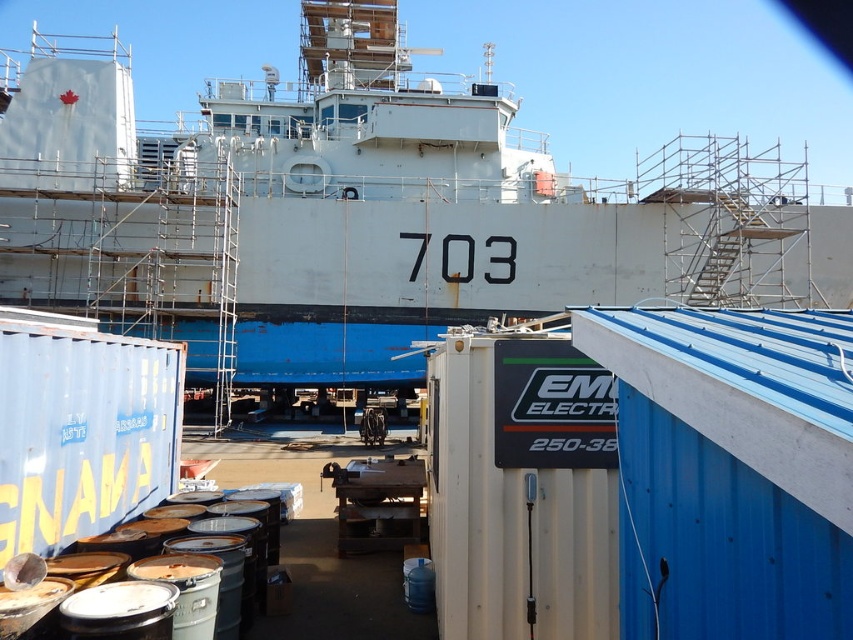
You are a worker in the shipyard and need to place a new tool box. The tool box is 2 meters in height. You have two options to place it either on the blue matte shipping container at lower left or on the metallic dock at center. Which location can safely accommodate the tool box based on their heights?

The blue matte shipping container at lower left is much taller than the metallic dock at center, so placing the tool box on the blue matte shipping container at lower left would be safer as it can support the height of the tool box.